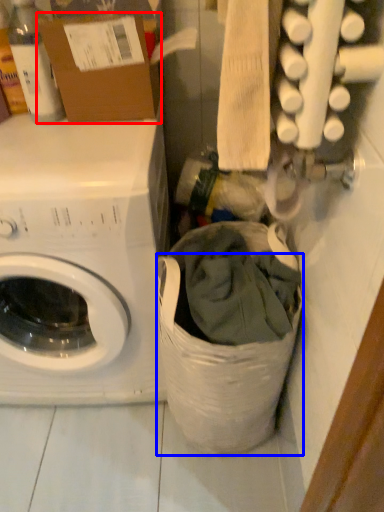
Question: Which object is further to the camera taking this photo, cardboard box (highlighted by a red box) or laundry basket (highlighted by a blue box)?

Choices:
 (A) cardboard box
 (B) laundry basket

Answer: (A)